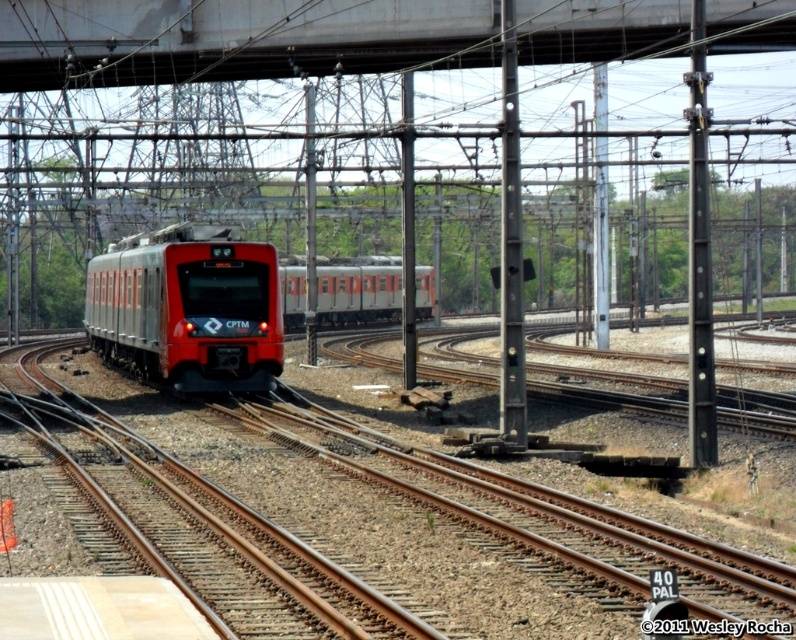
Can you confirm if metal at upper center is positioned to the right of matte silver train at center?

Yes, metal at upper center is to the right of matte silver train at center.

Is metal at upper center closer to camera compared to matte silver train at center?

Yes, metal at upper center is in front of matte silver train at center.

Does point (568, 38) come closer to viewer compared to point (295, 320)?

Yes, it is.

You are a GUI agent. You are given a task and a screenshot of the screen. Output one action in this format:
    pyautogui.click(x=<x>, y=<y>)
    Task: Click on the metal at upper center
    The image size is (796, 640).
    Given the screenshot: What is the action you would take?
    pyautogui.click(x=235, y=38)

Does metal train tracks at center have a greater width compared to matte red train at left?

Correct, the width of metal train tracks at center exceeds that of matte red train at left.

Is metal train tracks at center further to camera compared to matte red train at left?

That is False.

Is point (744, 627) behind point (242, 248)?

That is False.

At what (x,y) coordinates should I click in order to perform the action: click on metal train tracks at center. Please return your answer as a coordinate pair (x, y). Image resolution: width=796 pixels, height=640 pixels. Looking at the image, I should click on (365, 518).

Is metal train tracks at center thinner than metal at upper center?

Yes.

Does point (86, 444) come closer to viewer compared to point (114, 38)?

Yes.

This screenshot has height=640, width=796. Find the location of `metal train tracks at center`. metal train tracks at center is located at coordinates (365, 518).